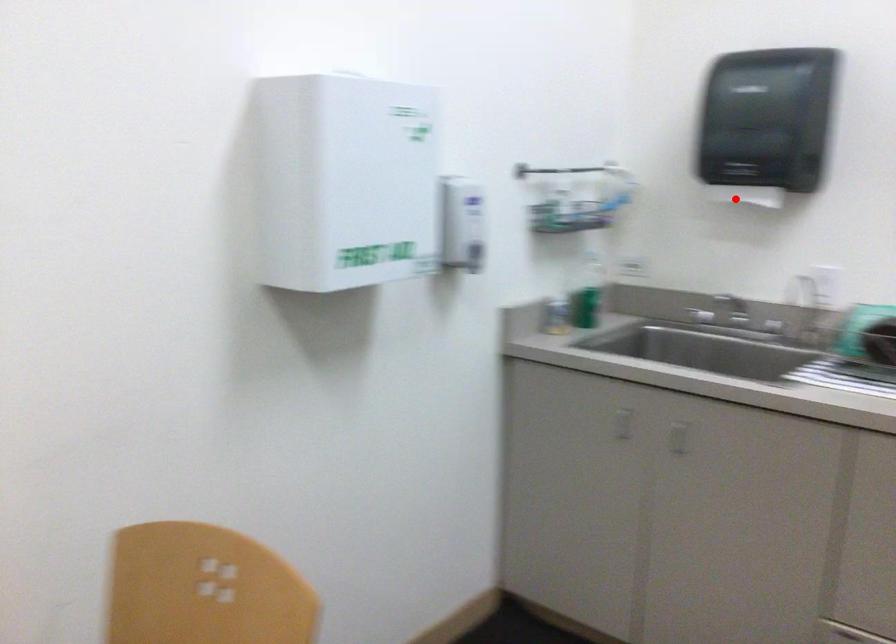
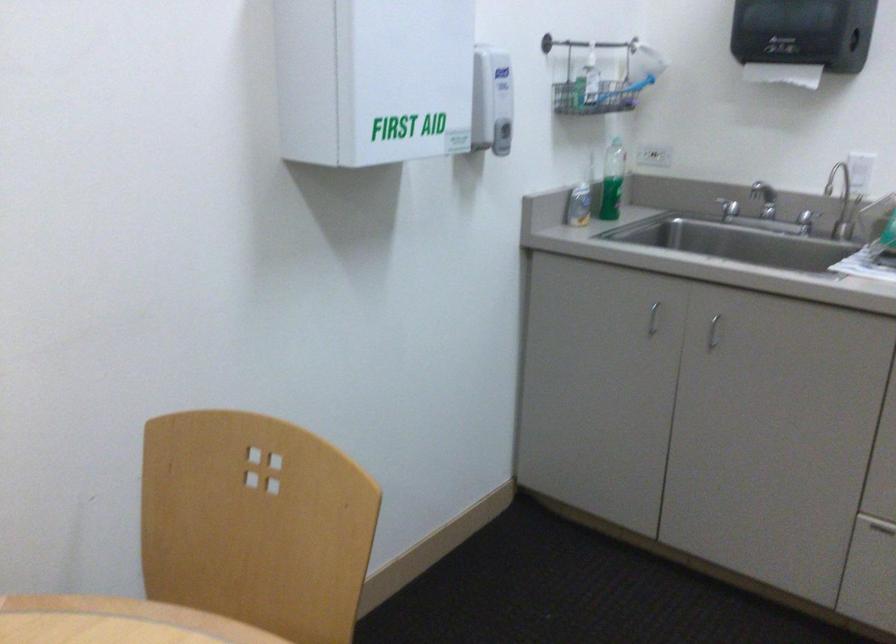
Where in the second image is the point corresponding to the highlighted location from the first image?

(782, 73)